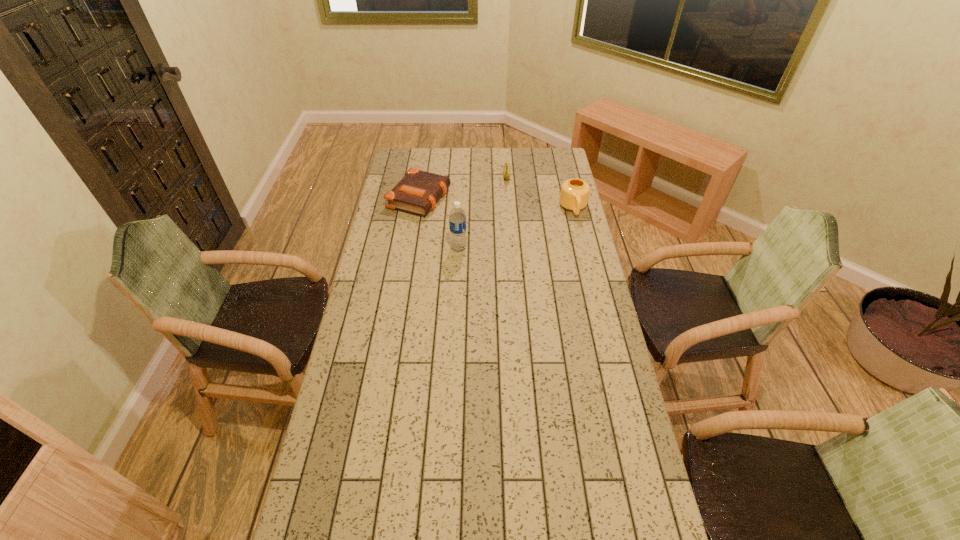
Locate an element on the screen. The width and height of the screenshot is (960, 540). vacant area situated on the spine side of the Bible is located at coordinates (485, 215).

This screenshot has height=540, width=960. I want to click on vacant area situated on the spine side of the Bible, so click(526, 226).

Locate an element on the screen. This screenshot has height=540, width=960. blank area located 0.380m on the spine side of the Bible is located at coordinates (524, 225).

Image resolution: width=960 pixels, height=540 pixels. I want to click on vacant space located at the stem of the third object from left to right, so click(x=506, y=205).

Locate an element on the screen. The width and height of the screenshot is (960, 540). vacant space positioned 0.370m at the stem of the third object from left to right is located at coordinates (505, 231).

Where is `vacant space positioned at the stem of the third object from left to right`? The height and width of the screenshot is (540, 960). vacant space positioned at the stem of the third object from left to right is located at coordinates (505, 234).

Locate an element on the screen. Image resolution: width=960 pixels, height=540 pixels. object that is at the far edge is located at coordinates (507, 165).

The width and height of the screenshot is (960, 540). Identify the location of object at the left edge. (418, 191).

Locate an element on the screen. object situated at the right edge is located at coordinates (574, 194).

Where is `vacant position at the far edge of the desktop`? The width and height of the screenshot is (960, 540). vacant position at the far edge of the desktop is located at coordinates (493, 148).